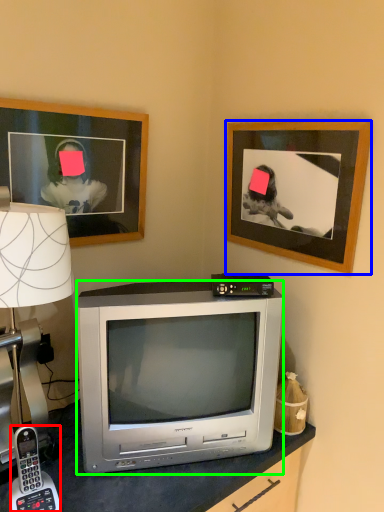
Question: Which object is the closest to the corded phone (highlighted by a red box)? Choose among these: picture frame (highlighted by a blue box) or television (highlighted by a green box).

Choices:
 (A) picture frame
 (B) television

Answer: (B)